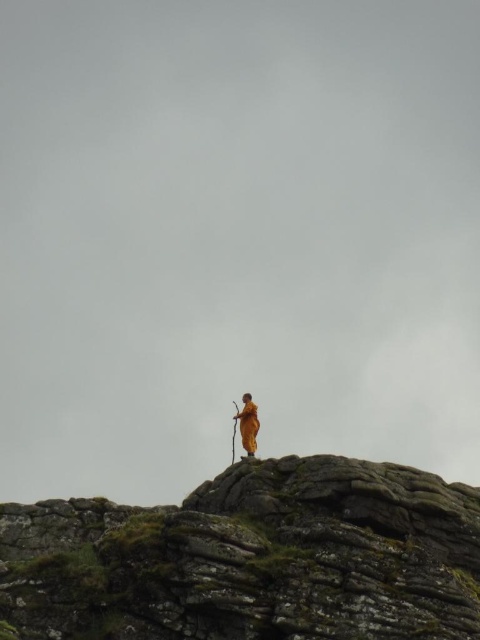
Question: Which object is farther from the camera taking this photo?

Choices:
 (A) mossy rock at center
 (B) golden fabric statue at center

Answer: (B)

Question: Does mossy rock at center lie in front of golden fabric statue at center?

Choices:
 (A) yes
 (B) no

Answer: (A)

Question: Does mossy rock at center appear on the left side of golden fabric statue at center?

Choices:
 (A) yes
 (B) no

Answer: (A)

Question: Which of the following is the closest to the observer?

Choices:
 (A) golden fabric statue at center
 (B) mossy rock at center

Answer: (B)

Question: In this image, where is mossy rock at center located relative to golden fabric statue at center?

Choices:
 (A) left
 (B) right

Answer: (A)